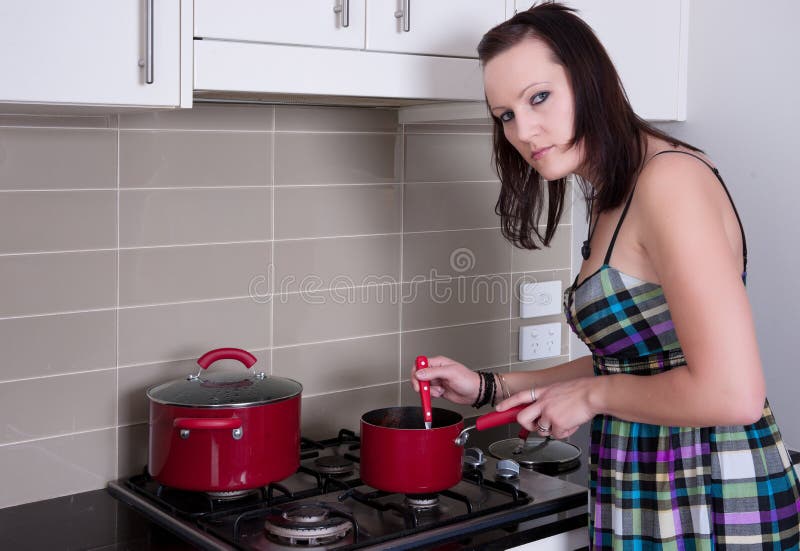
This screenshot has height=551, width=800. Find the location of `pot handle`. pot handle is located at coordinates (490, 418).